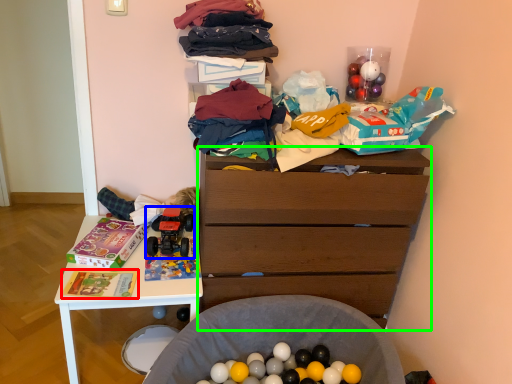
Question: Which is farther away from magazine (highlighted by a red box)? toy (highlighted by a blue box) or chest of drawers (highlighted by a green box)?

Choices:
 (A) toy
 (B) chest of drawers

Answer: (B)